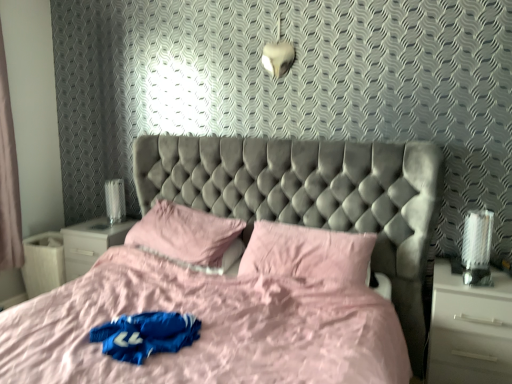
Locate an element on the screen. The height and width of the screenshot is (384, 512). free space in front of white glossy table lamp at left is located at coordinates (100, 229).